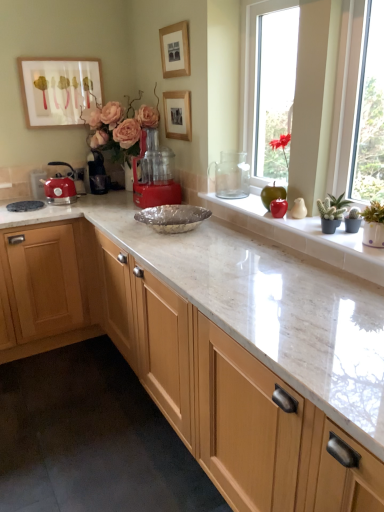
At what (x,y) coordinates should I click in order to perform the action: click on free spot to the left of green succulent at right, which is counted as the 2th plant, starting from the back. Please return your answer as a coordinate pair (x, y). The height and width of the screenshot is (512, 384). Looking at the image, I should click on (300, 225).